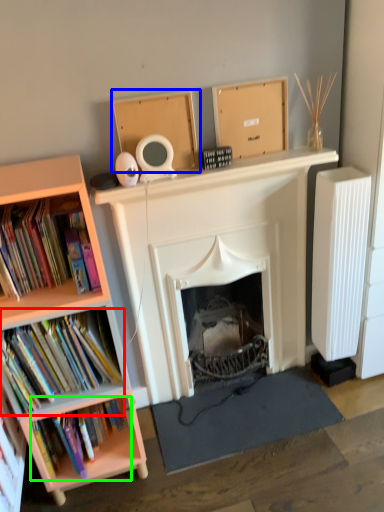
Question: Estimate the real-world distances between objects in this image. Which object is farther from book (highlighted by a red box), cardboard box (highlighted by a blue box) or book (highlighted by a green box)?

Choices:
 (A) cardboard box
 (B) book

Answer: (A)